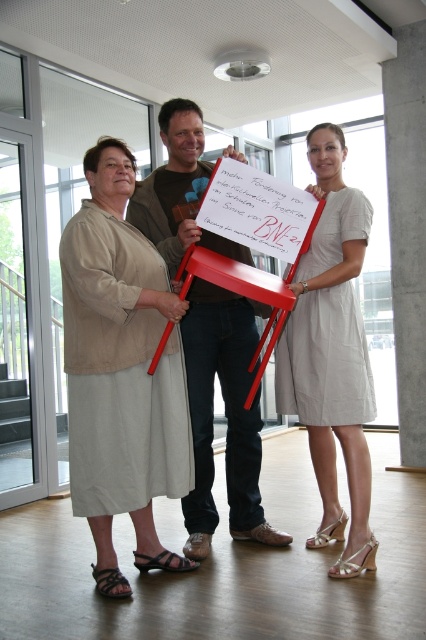
You are a fashion designer observing the scene. You notice two dresses in the image, the beige fabric dress at left and the light beige dress at center. Which dress has a larger size?

The beige fabric dress at left is bigger than the light beige dress at center.

You are standing in the room and want to move to the point at coordinates point (108, 381). If your walking speed is 3 feet per second, how many seconds will it take you to reach that point?

The distance between you and point (108, 381) is 8.73 feet. At a speed of 3 feet per second, it will take 8.73 divided by 3, which is approximately 2.91 seconds to reach the point.

You are standing at point (123, 342) and want to walk to point (233, 452). Which direction should you move?

You should move backward because point (123, 342) is in front of point (233, 452).